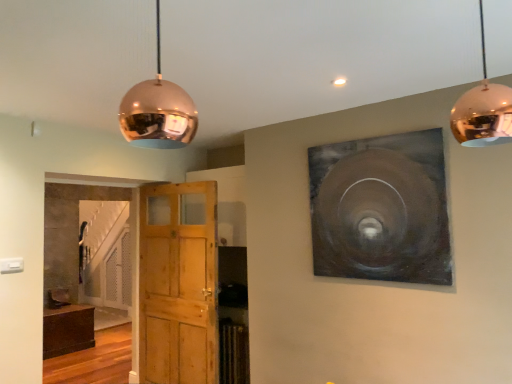
The width and height of the screenshot is (512, 384). I want to click on free point above metallic silver painting at upper right (from a real-world perspective), so click(372, 134).